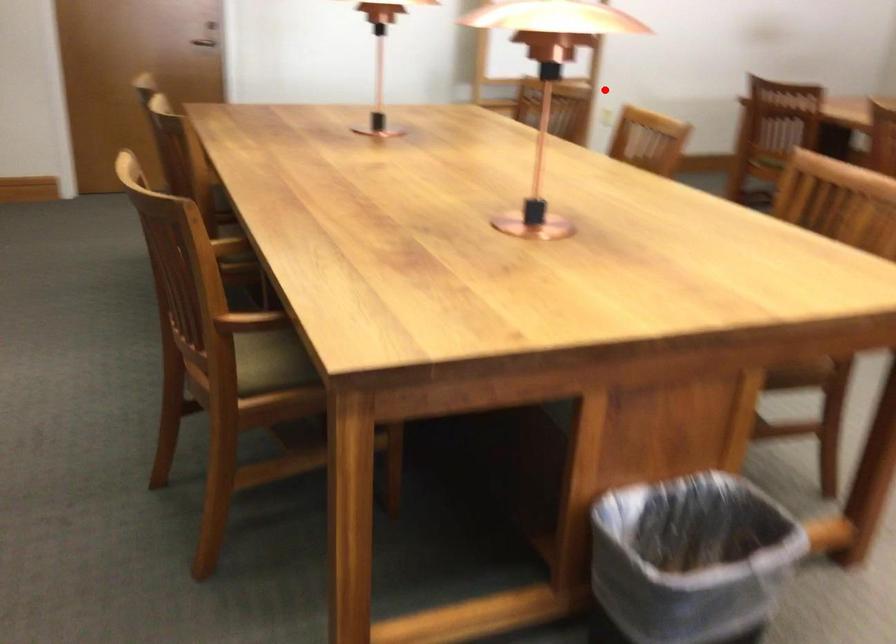
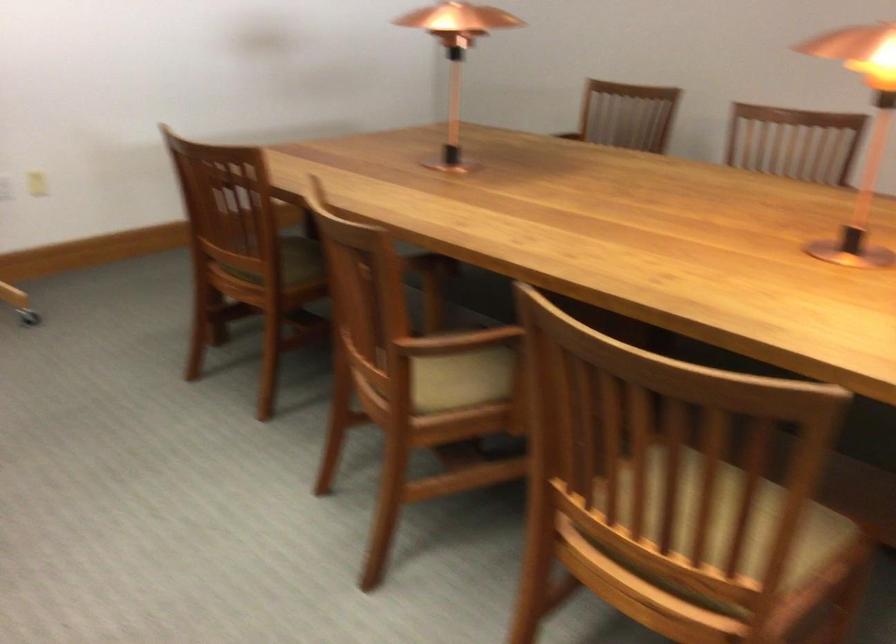
Question: I am providing you with two images of the same scene from different viewpoints. Given a red point in image1, look at the same physical point in image2. Is it:

Choices:
 (A) Closer to the viewpoint
 (B) Farther from the viewpoint

Answer: (A)